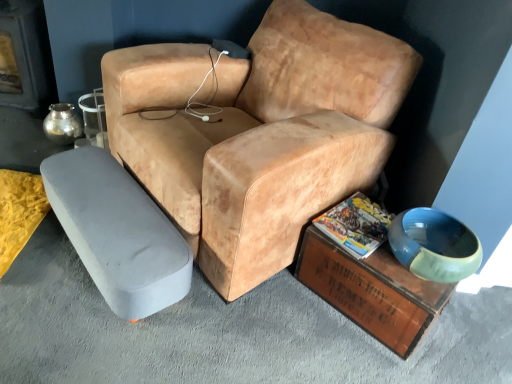
Image resolution: width=512 pixels, height=384 pixels. What are the coordinates of `vacant area on top of smooth gray concrete at lower left (from a real-world perspective)` in the screenshot? It's located at (239, 317).